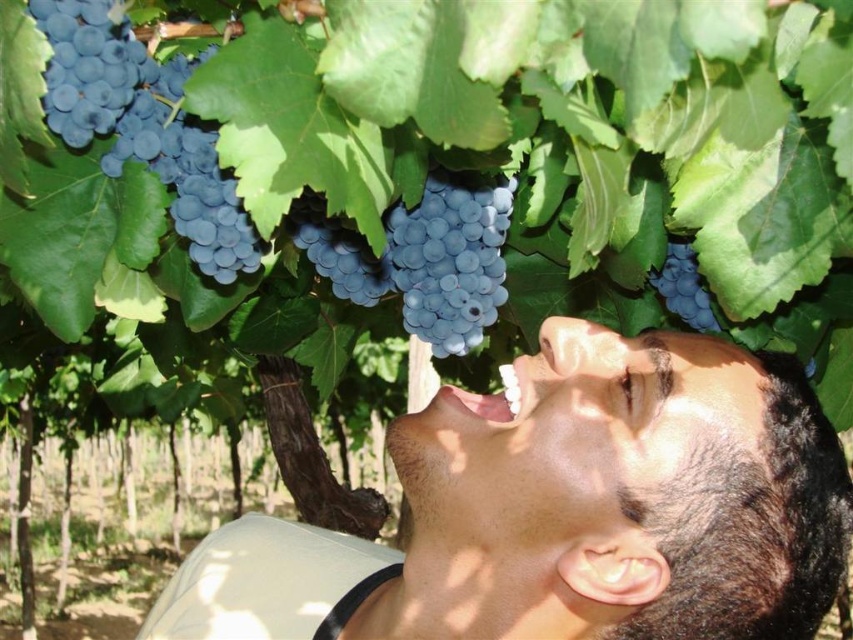
Who is taller, smooth skin face at center or matte dark blue grape at upper right?

With more height is smooth skin face at center.

Measure the distance from smooth skin face at center to matte dark blue grape at upper right.

A distance of 15.24 inches exists between smooth skin face at center and matte dark blue grape at upper right.

This screenshot has height=640, width=853. I want to click on smooth skin face at center, so click(x=566, y=512).

Image resolution: width=853 pixels, height=640 pixels. Describe the element at coordinates (143, 125) in the screenshot. I see `blue matte grapes at upper left` at that location.

Can you confirm if blue matte grapes at upper left is wider than blue matte grape at center?

No.

This screenshot has width=853, height=640. What are the coordinates of `blue matte grapes at upper left` in the screenshot? It's located at (143, 125).

At what (x,y) coordinates should I click in order to perform the action: click on blue matte grapes at upper left. Please return your answer as a coordinate pair (x, y). Looking at the image, I should click on (143, 125).

Is blue matte grape at center to the right of matte dark blue grape at upper right from the viewer's perspective?

No, blue matte grape at center is not to the right of matte dark blue grape at upper right.

Find the location of a particular element. Image resolution: width=853 pixels, height=640 pixels. blue matte grape at center is located at coordinates (422, 259).

The height and width of the screenshot is (640, 853). What do you see at coordinates (422, 259) in the screenshot? I see `blue matte grape at center` at bounding box center [422, 259].

Where is `blue matte grape at center`? Image resolution: width=853 pixels, height=640 pixels. blue matte grape at center is located at coordinates (422, 259).